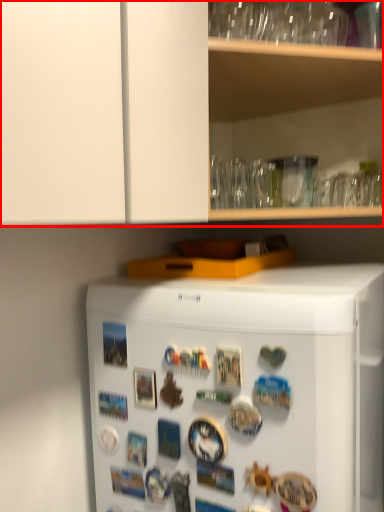
Question: Considering the relative positions of cabinetry (annotated by the red box) and refrigerator in the image provided, where is cabinetry (annotated by the red box) located with respect to the staircase?

Choices:
 (A) left
 (B) right

Answer: (B)